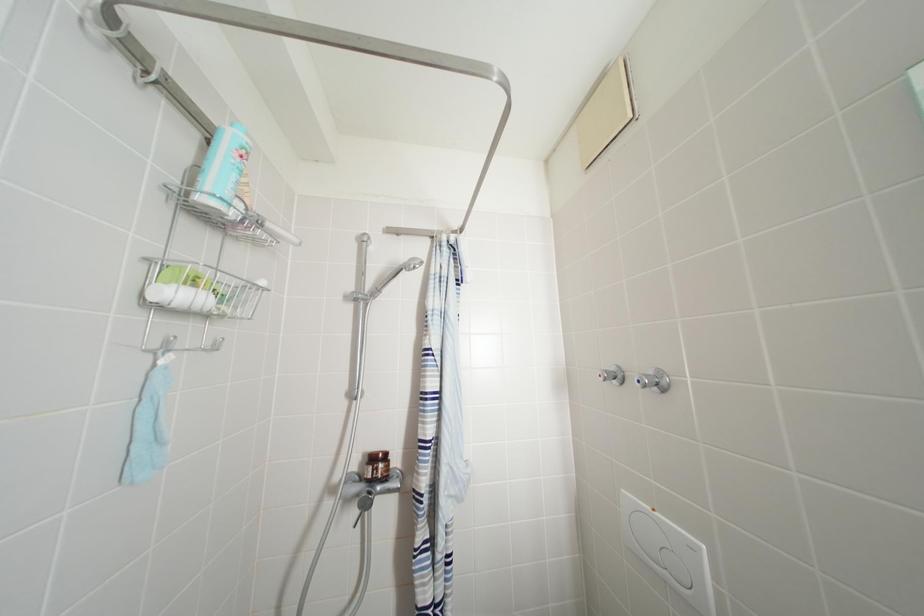
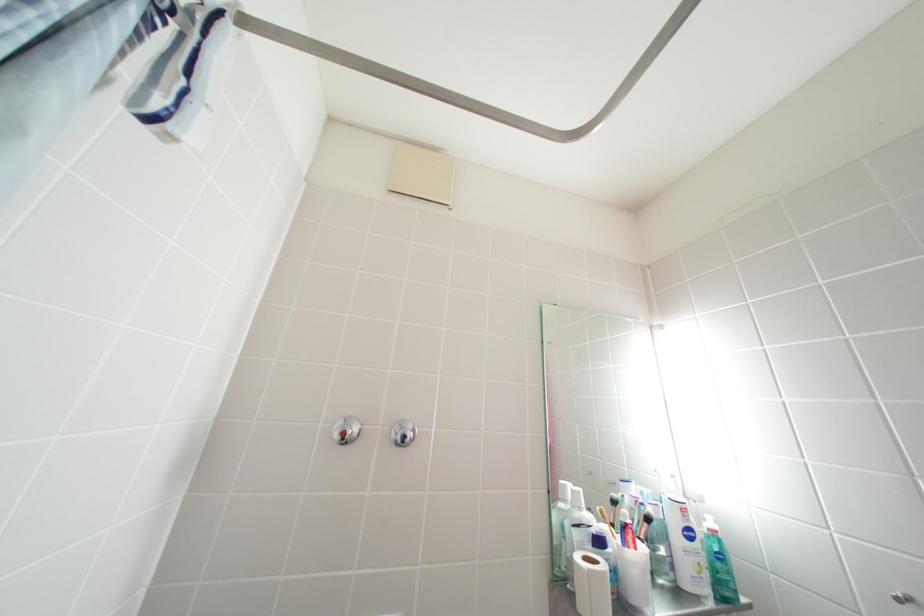
First-person continuous shooting, in which direction is the camera rotating?

The camera's rotation is toward right-up.